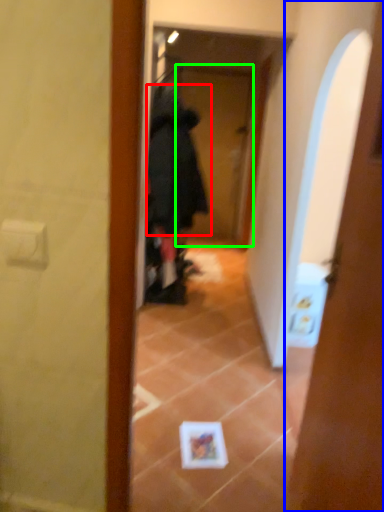
Question: Considering the real-world distances, which object is farthest from bathrobe (highlighted by a red box)? door (highlighted by a blue box) or screen door (highlighted by a green box)?

Choices:
 (A) door
 (B) screen door

Answer: (B)